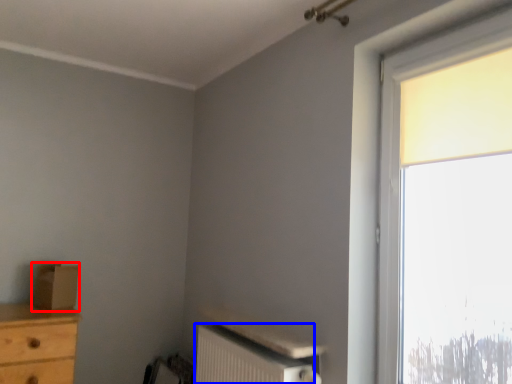
Question: Which object is closer to the camera taking this photo, cardboard box (highlighted by a red box) or radiator (highlighted by a blue box)?

Choices:
 (A) cardboard box
 (B) radiator

Answer: (B)